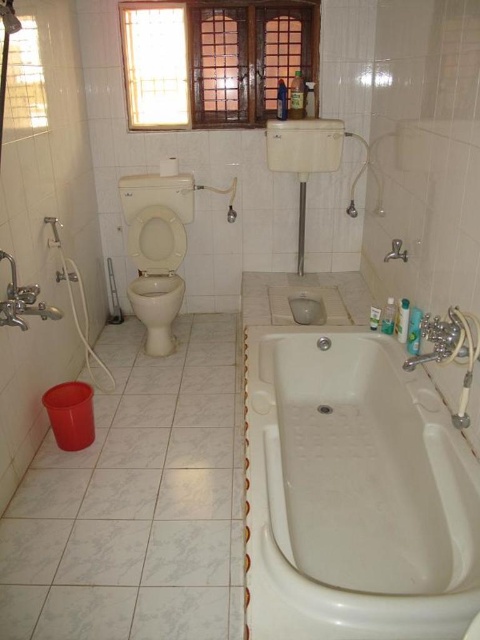
Question: Is the position of wooden window at upper center more distant than that of white glossy sink at center?

Choices:
 (A) no
 (B) yes

Answer: (B)

Question: Where is white glossy bathtub at lower right located in relation to white glossy sink at upper center in the image?

Choices:
 (A) below
 (B) above

Answer: (A)

Question: Based on their relative distances, which object is nearer to the beige ceramic toilet bowl at center?

Choices:
 (A) white glossy sink at center
 (B) wooden window at upper center
 (C) white glossy bathtub at lower right
 (D) white glossy sink at upper center

Answer: (A)

Question: Is wooden window at upper center above white glossy sink at center?

Choices:
 (A) no
 (B) yes

Answer: (B)

Question: Which of the following is the closest to the observer?

Choices:
 (A) (304, 164)
 (B) (244, 524)

Answer: (B)

Question: Which point is farther to the camera?

Choices:
 (A) (182, 296)
 (B) (288, 332)
 (C) (245, 8)

Answer: (A)